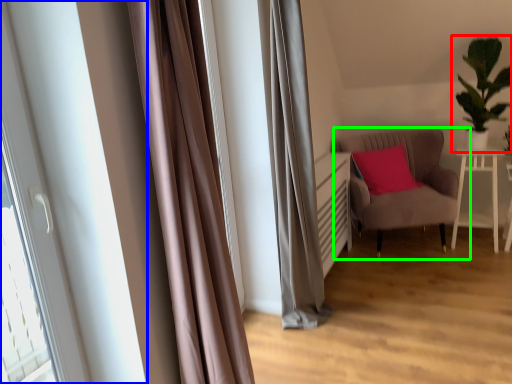
Question: Which object is positioned farthest from houseplant (highlighted by a red box)? Select from bay window (highlighted by a blue box) and chair (highlighted by a green box).

Choices:
 (A) bay window
 (B) chair

Answer: (A)